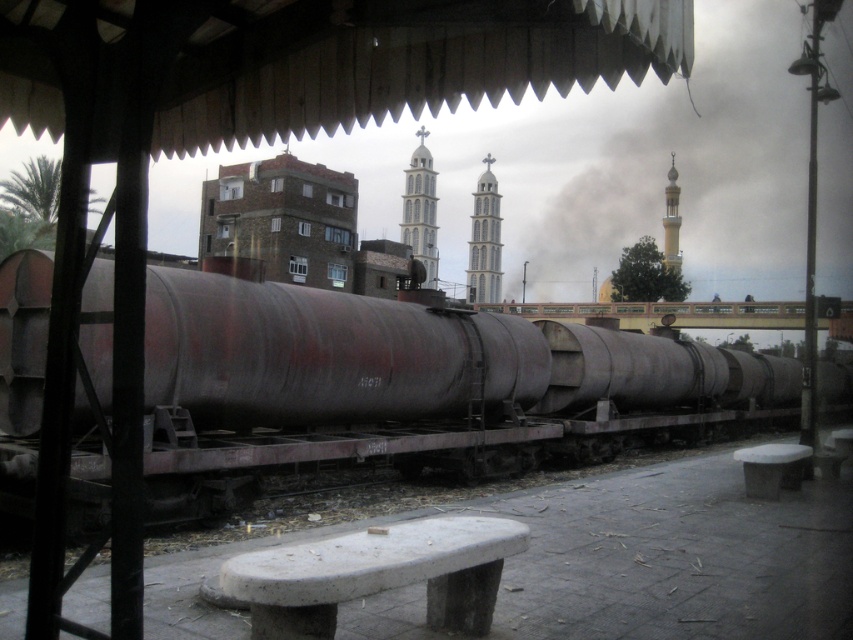
Question: Is white glass tower at center below smooth white minaret at upper right?

Choices:
 (A) yes
 (B) no

Answer: (A)

Question: Is rusty metal train car at center to the left of white stone tower at center from the viewer's perspective?

Choices:
 (A) no
 (B) yes

Answer: (A)

Question: Which of the following is the farthest from the observer?

Choices:
 (A) white stone tower at center
 (B) rusty metal train car at center

Answer: (A)

Question: Which object is closer to the camera taking this photo?

Choices:
 (A) smooth white minaret at upper right
 (B) white glass tower at center
 (C) rusty metal train car at center
 (D) white stone tower at center

Answer: (C)

Question: Which object is farther from the camera taking this photo?

Choices:
 (A) white stone tower at center
 (B) white glass tower at center
 (C) rusty metal train car at center
 (D) smooth white minaret at upper right

Answer: (B)

Question: Can you confirm if rusty metal train car at center is positioned to the left of white glass tower at center?

Choices:
 (A) yes
 (B) no

Answer: (B)